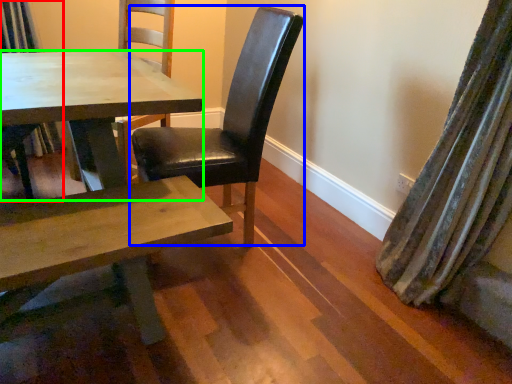
Question: Considering the real-world distances, which object is closest to chair (highlighted by a red box)? chair (highlighted by a blue box) or kitchen & dining room table (highlighted by a green box).

Choices:
 (A) chair
 (B) kitchen & dining room table

Answer: (B)